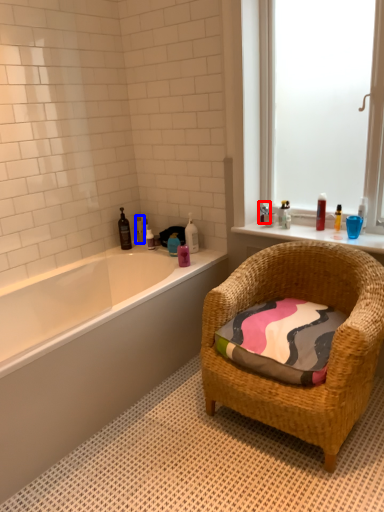
Question: Which object appears farthest to the camera in this image, toiletry (highlighted by a red box) or toiletry (highlighted by a blue box)?

Choices:
 (A) toiletry
 (B) toiletry

Answer: (B)